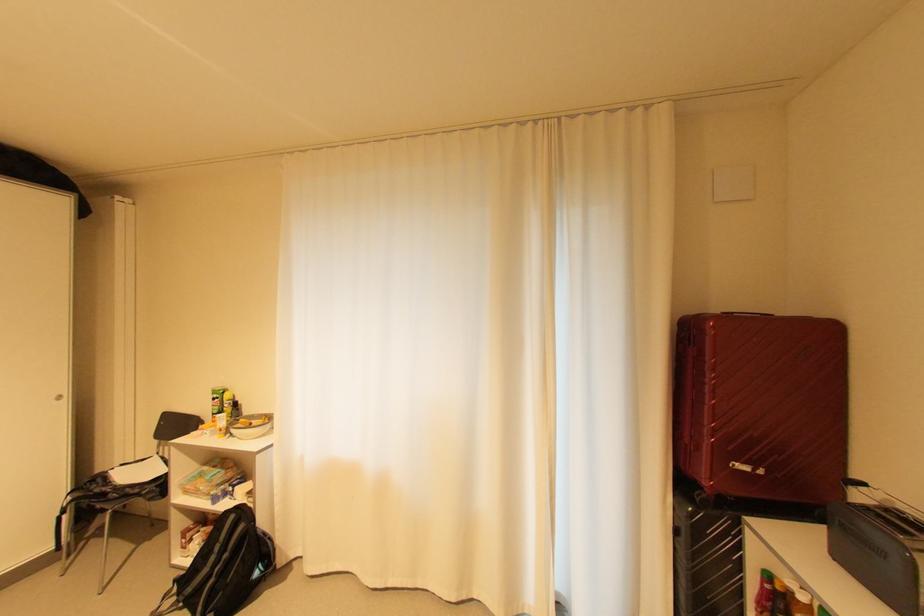
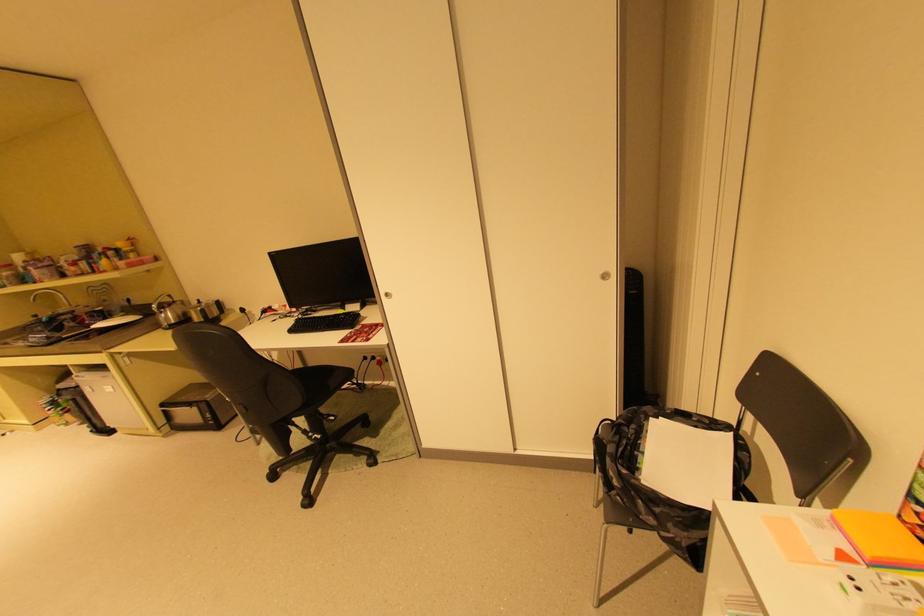
Locate, in the second image, the point that corresponds to (107,479) in the first image.

(640, 427)